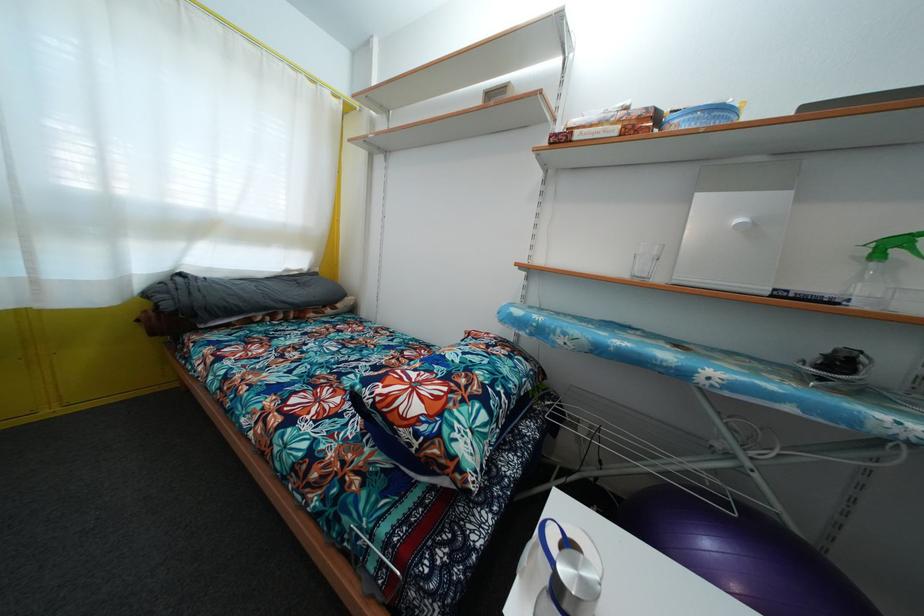
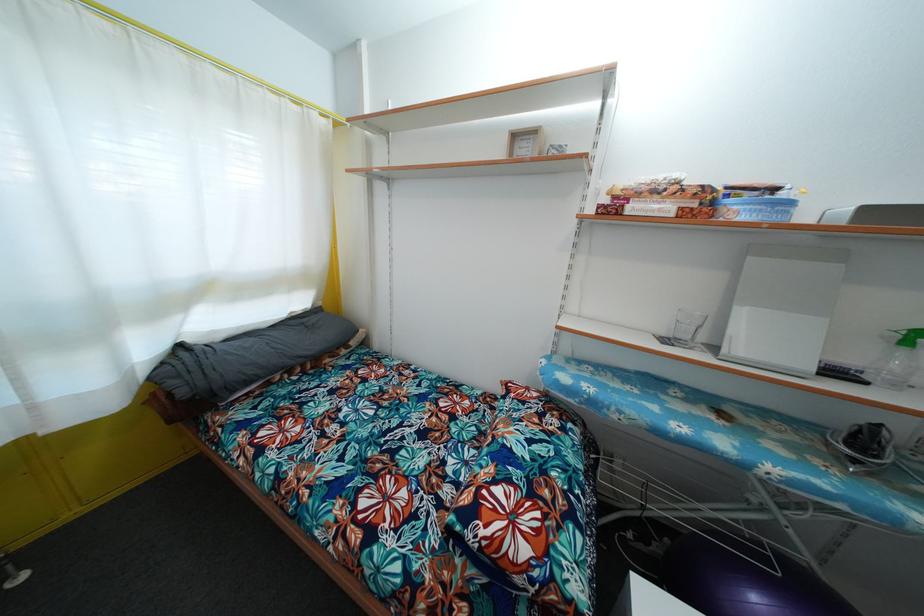
In the second image, find the point that corresponds to point (171, 312) in the first image.

(187, 399)